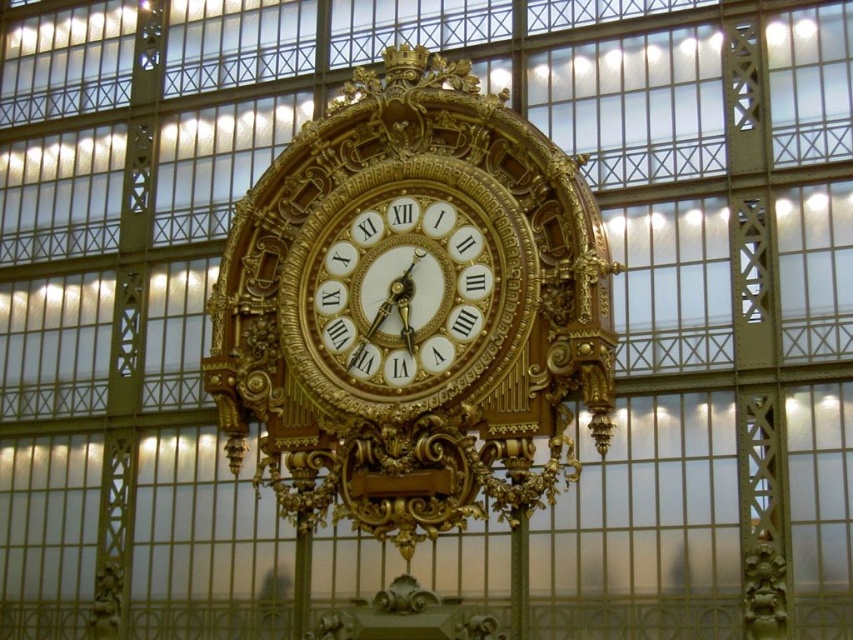
You are standing in the industrial interior space and want to know how far the point marked as point (310, 333) is from you. Can you determine the distance?

The point marked as point (310, 333) is 217.01 feet away from you.

You are an interior designer planning to place a new decorative item on the wall where the gold ornate clock at center and the gold metallic clock at center are displayed. To ensure proper spacing, you need to know which clock is wider. Which one has a greater width?

The gold ornate clock at center has a greater width than the gold metallic clock at center according to the description.

You are standing in front of the ornate clock in the industrial space. You notice two points marked on the clock. The first point is at coordinates point (511, 424) and the second is at point (328, 368). If you were to reach out and touch one of them, which point would feel closer to your hand?

Point (511, 424) is closer to the camera than point (328, 368), so you would feel that point closer to your hand.